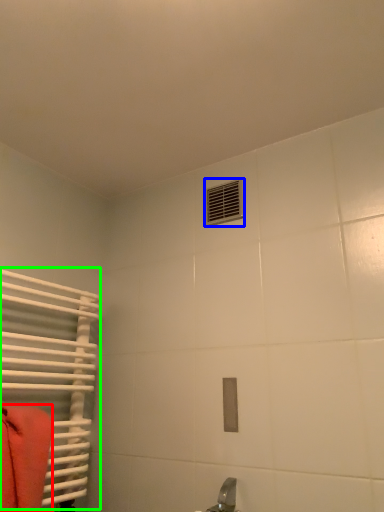
Question: Based on their relative distances, which object is nearer to towel (highlighted by a red box)? Choose from air conditioning (highlighted by a blue box) and radiator (highlighted by a green box).

Choices:
 (A) air conditioning
 (B) radiator

Answer: (B)